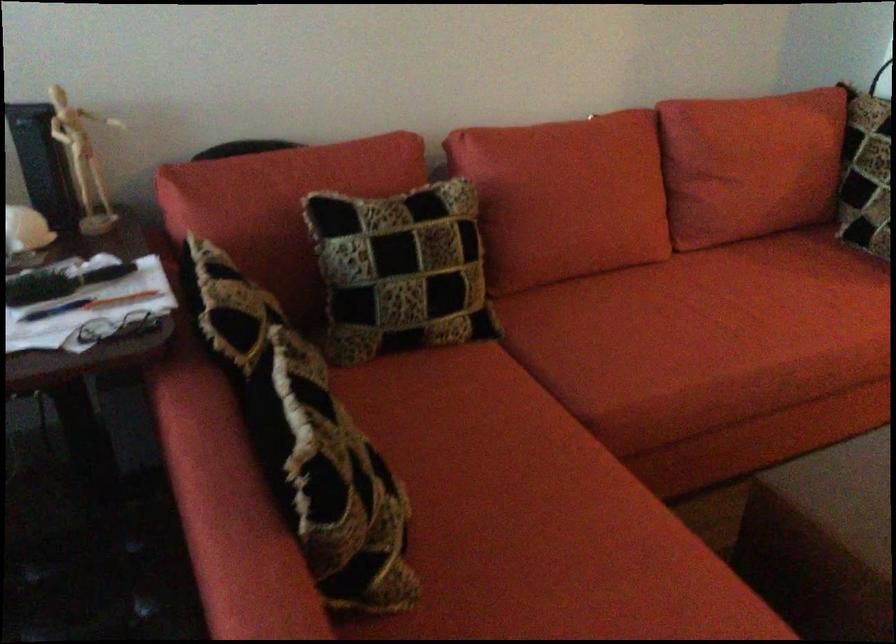
Where is `wooden artist mannequin`? Image resolution: width=896 pixels, height=644 pixels. wooden artist mannequin is located at coordinates (82, 160).